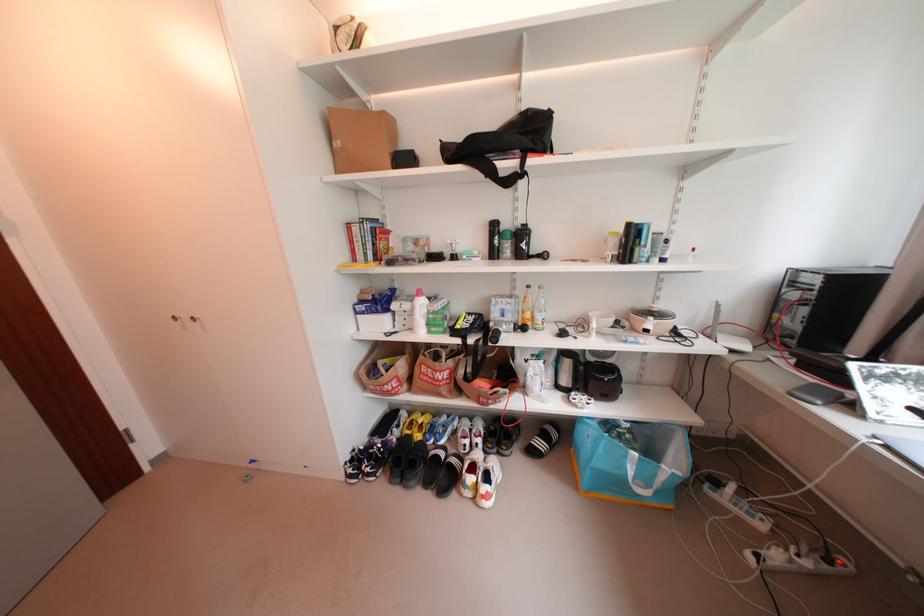
The location [813,557] corresponds to which object?

It corresponds to the white power strip in the image.